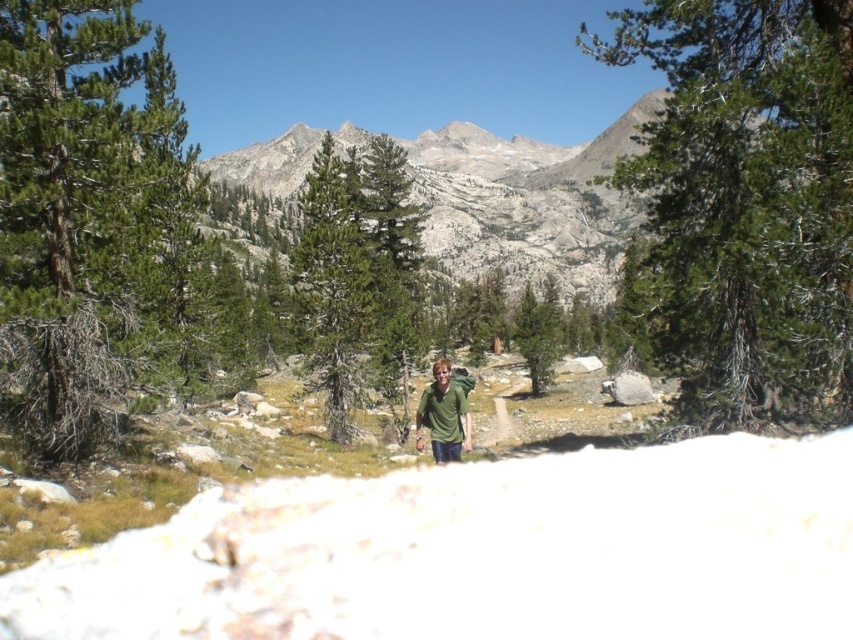
You are standing at the point with coordinates 0.5, 0.5 in the image. Which direction should you move to reach the green rough bark tree at center?

To reach the green rough bark tree at center located at point (329, 289) from your current position at (426, 320), you should move slightly to the left and down.